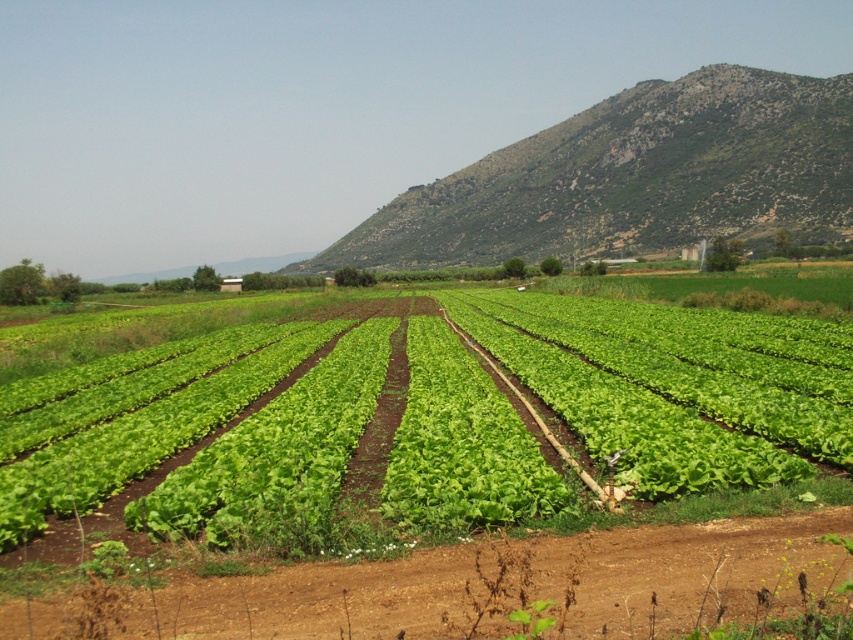
You are a farmer checking the crops and notice the green leafy vegetable at center and the green grassy hillside at upper right. Which object is located to the right when viewed from your perspective?

The green grassy hillside at upper right is located to the right of the green leafy vegetable at center.